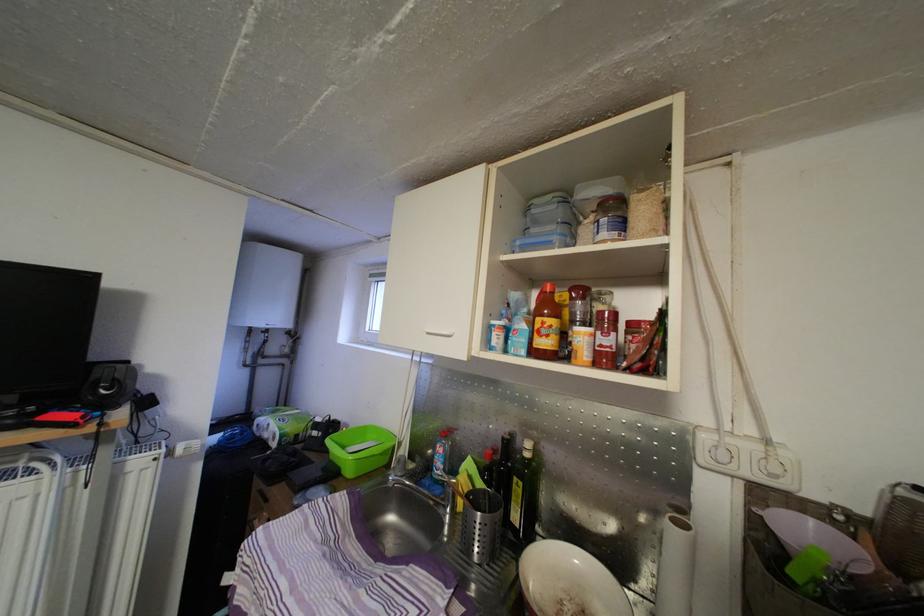
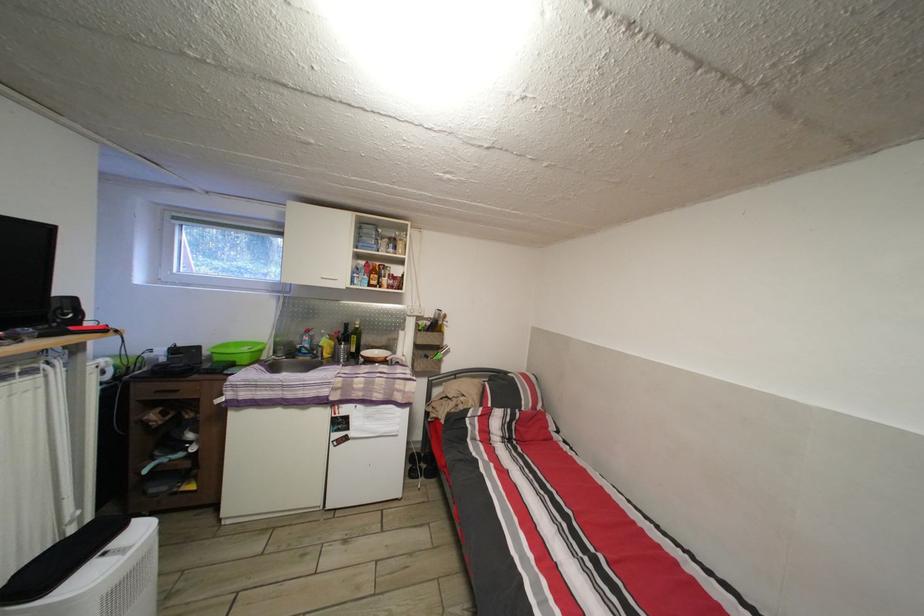
Where in the second image is the point corresponding to [274,507] from the first image?

(184, 398)